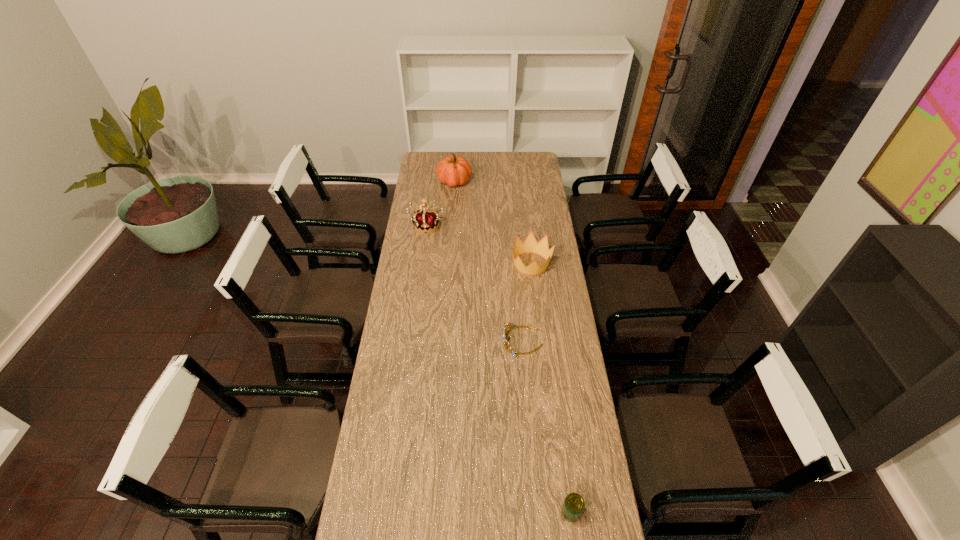
You are a GUI agent. You are given a task and a screenshot of the screen. Output one action in this format:
    pyautogui.click(x=<x>, y=<y>)
    Task: Click on the vacant space located on the back of the third tallest object
    
    Given the screenshot: What is the action you would take?
    pyautogui.click(x=526, y=223)

This screenshot has height=540, width=960. I want to click on free spot located on the front-facing side of the shorter tiara, so click(x=408, y=341).

Where is `vacant space located 0.070m on the front-facing side of the shorter tiara`? Image resolution: width=960 pixels, height=540 pixels. vacant space located 0.070m on the front-facing side of the shorter tiara is located at coordinates (485, 341).

Where is `vacant space located on the front-facing side of the shorter tiara`? The width and height of the screenshot is (960, 540). vacant space located on the front-facing side of the shorter tiara is located at coordinates (425, 341).

Locate an element on the screen. The width and height of the screenshot is (960, 540). vacant space located 0.120m on the left of the nearest object is located at coordinates (521, 512).

Find the location of a particular element. This screenshot has height=540, width=960. object situated at the far edge is located at coordinates (453, 170).

Locate an element on the screen. This screenshot has height=540, width=960. pumpkin that is at the left edge is located at coordinates (453, 170).

This screenshot has width=960, height=540. I want to click on tiara located in the left edge section of the desktop, so click(x=425, y=219).

Locate an element on the screen. The height and width of the screenshot is (540, 960). crown that is at the right edge is located at coordinates (530, 245).

The width and height of the screenshot is (960, 540). What are the coordinates of `tiara present at the right edge` in the screenshot? It's located at (507, 345).